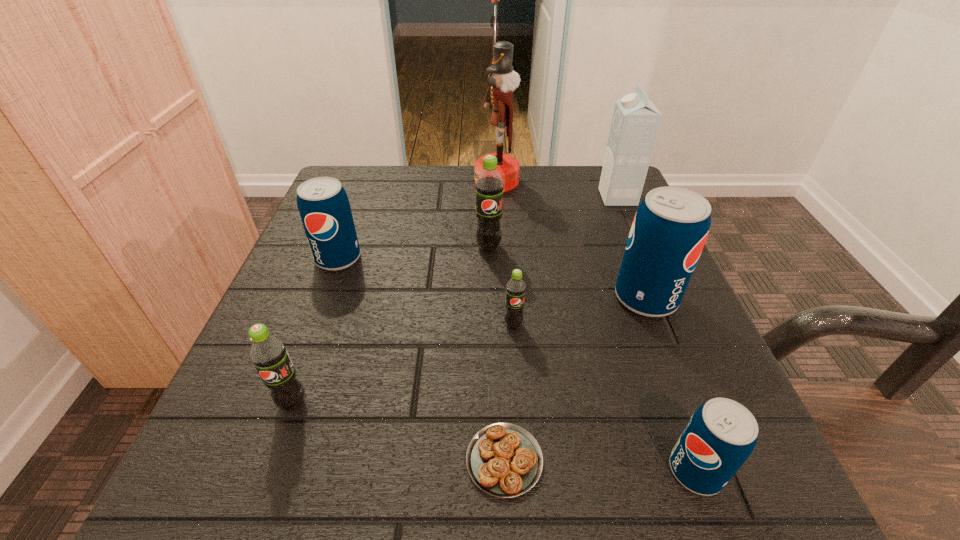
This screenshot has width=960, height=540. In order to click on vacant space located on the front label of the farthest green soda in this screenshot , I will do `click(490, 280)`.

Locate an element on the screen. This screenshot has height=540, width=960. free space located on the right of the farthest blue pop is located at coordinates (413, 259).

Where is `vacant space located on the front label of the second farthest green soda`? The image size is (960, 540). vacant space located on the front label of the second farthest green soda is located at coordinates (518, 391).

The width and height of the screenshot is (960, 540). Find the location of `vacant space located on the back of the smallest blue pop`. vacant space located on the back of the smallest blue pop is located at coordinates (617, 254).

The image size is (960, 540). Find the location of `free space located on the back of the shortest object`. free space located on the back of the shortest object is located at coordinates (499, 339).

Identify the location of nutcracker at the far edge. The height and width of the screenshot is (540, 960). (503, 79).

Locate an element on the screen. This screenshot has width=960, height=540. carton that is at the far edge is located at coordinates (635, 123).

Identify the location of pop that is at the near edge. (720, 436).

The width and height of the screenshot is (960, 540). I want to click on pastry located in the near edge section of the desktop, so click(x=504, y=460).

Image resolution: width=960 pixels, height=540 pixels. Identify the location of carton present at the right edge. (635, 123).